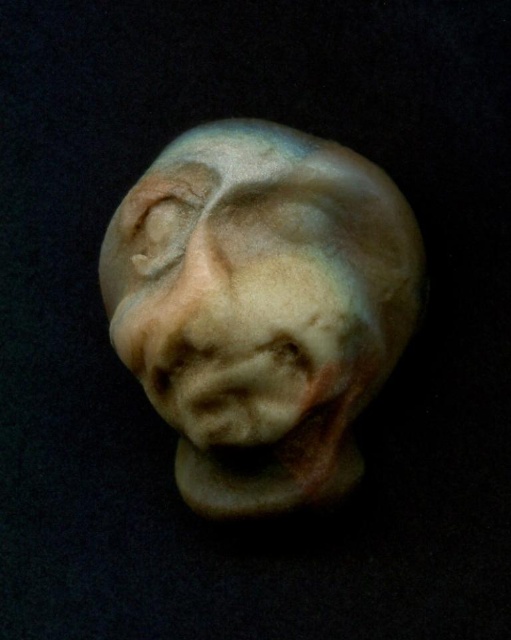
Does matte clay sculpture at center have a greater height compared to matte clay nose at center?

Yes, matte clay sculpture at center is taller than matte clay nose at center.

Where is `matte clay sculpture at center`? matte clay sculpture at center is located at coordinates (262, 307).

The image size is (511, 640). What are the coordinates of `matte clay sculpture at center` in the screenshot? It's located at (262, 307).